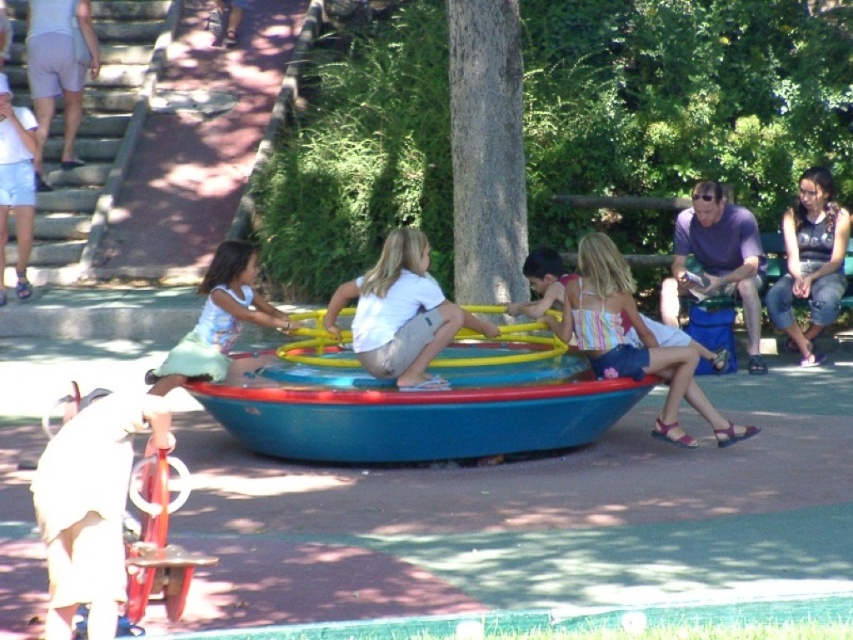
You are a parent at the playground and you see the blue plastic boat at center and the light green fabric dress at center. Which object is located to the right of the other?

The blue plastic boat at center is positioned on the right side of light green fabric dress at center.

You are standing at the center of the playground and want to reach both points marked in the image. Which point, point (274, 390) or point (822, 230), will you reach first as you move forward?

You will reach point (274, 390) first because it is closer to the camera than point (822, 230).

You are a photographer trying to capture a photo of the denim shorts at lower right and the light green fabric dress at center. If you want to ensure both are fully visible in the frame, which clothing item requires more horizontal space in the photo?

The light green fabric dress at center requires more horizontal space because its width is greater than the denim shorts at lower right.